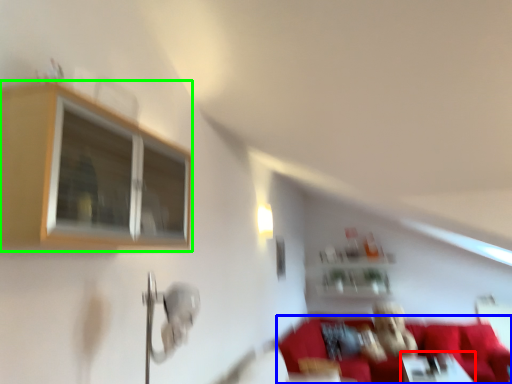
Question: Which is farther away from table (highlighted by a red box)? couch (highlighted by a blue box) or window (highlighted by a green box)?

Choices:
 (A) couch
 (B) window

Answer: (B)